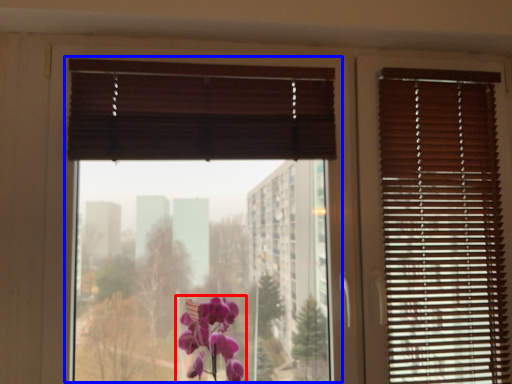
Question: Which of the following is the closest to the observer, flower (highlighted by a red box) or window screen (highlighted by a blue box)?

Choices:
 (A) flower
 (B) window screen

Answer: (A)